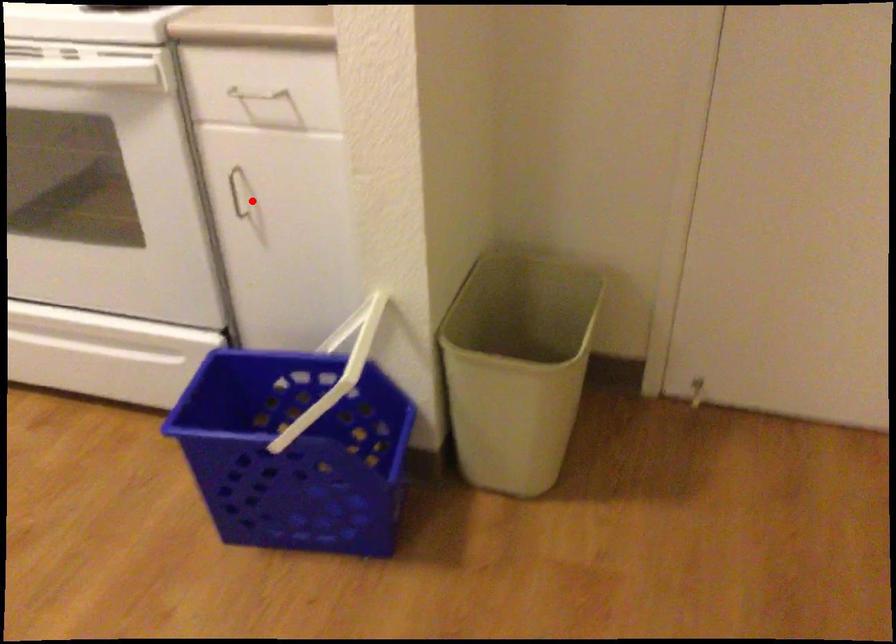
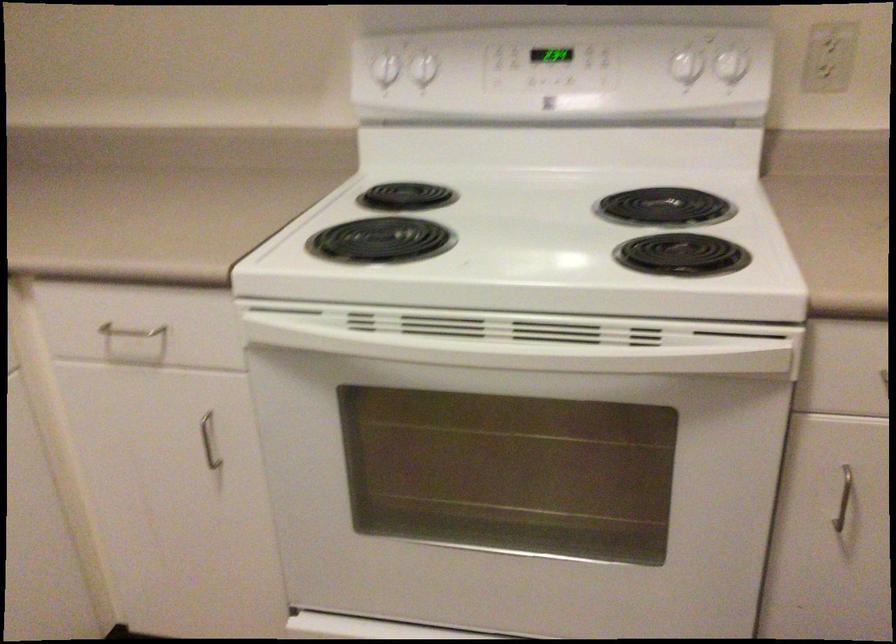
Locate, in the second image, the point that corresponds to the highlighted location in the first image.

(842, 498)